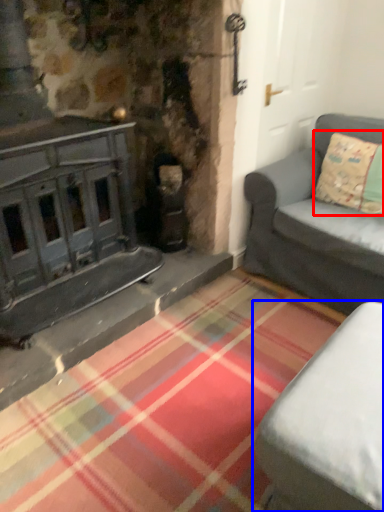
Question: Which of the following is the farthest to the observer, pillow (highlighted by a red box) or studio couch (highlighted by a blue box)?

Choices:
 (A) pillow
 (B) studio couch

Answer: (A)